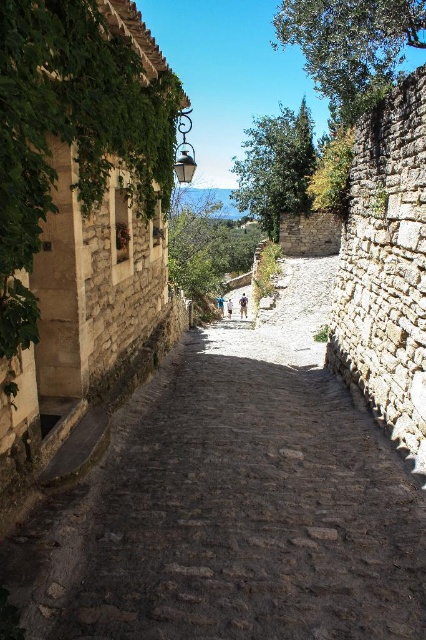
You are a delivery person carrying a large box and need to walk along the brown cobblestone path at center. There is green leafy ivy at upper left growing on the wall. Since the path is narrow, can you pass through without hitting the ivy?

The brown cobblestone path at center is wider than the green leafy ivy at upper left, so yes, you can pass through without hitting the ivy.

You are standing at the entrance of the narrow cobblestone street and see the point at coordinates (233, 502). Based on the scene description, what is the object located at that point?

The point at coordinates (233, 502) corresponds to the brown cobblestone path at center.